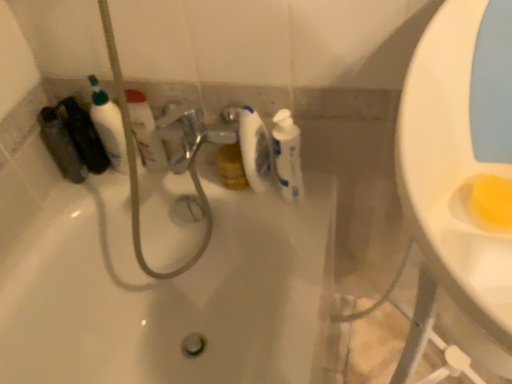
Question: Is white glossy bottle at center, the second cleaning product from the left, far from white glossy bottle at upper left, arranged as the 1th cleaning product when viewed from the left?

Choices:
 (A) yes
 (B) no

Answer: (B)

Question: From the image's perspective, is white glossy bottle at center, marked as the first cleaning product in a right-to-left arrangement, beneath white glossy bottle at upper left, which ranks as the second cleaning product in right-to-left order?

Choices:
 (A) no
 (B) yes

Answer: (B)

Question: Considering the relative sizes of white glossy bottle at center, marked as the first cleaning product in a right-to-left arrangement, and white glossy bottle at upper left, which ranks as the second cleaning product in right-to-left order, in the image provided, is white glossy bottle at center, marked as the first cleaning product in a right-to-left arrangement, thinner than white glossy bottle at upper left, which ranks as the second cleaning product in right-to-left order,?

Choices:
 (A) yes
 (B) no

Answer: (B)

Question: Considering the relative positions of white glossy bottle at center, marked as the first cleaning product in a right-to-left arrangement, and white glossy bottle at upper left, which ranks as the second cleaning product in right-to-left order, in the image provided, is white glossy bottle at center, marked as the first cleaning product in a right-to-left arrangement, to the left of white glossy bottle at upper left, which ranks as the second cleaning product in right-to-left order, from the viewer's perspective?

Choices:
 (A) yes
 (B) no

Answer: (B)

Question: From a real-world perspective, is white glossy bottle at center, the second cleaning product from the left, positioned over white glossy bottle at upper left, arranged as the 1th cleaning product when viewed from the left, based on gravity?

Choices:
 (A) no
 (B) yes

Answer: (B)

Question: Relative to white glossy bathtub at center, is white glossy bottle at center, marked as the first cleaning product in a right-to-left arrangement, in front or behind?

Choices:
 (A) behind
 (B) front

Answer: (A)

Question: Is white glossy bottle at center, the second cleaning product from the left, taller or shorter than white glossy bathtub at center?

Choices:
 (A) short
 (B) tall

Answer: (A)

Question: Do you think white glossy bottle at center, marked as the first cleaning product in a right-to-left arrangement, is within white glossy bathtub at center, or outside of it?

Choices:
 (A) outside
 (B) inside

Answer: (A)

Question: From the image's perspective, is white glossy bottle at center, marked as the first cleaning product in a right-to-left arrangement, above or below white glossy bathtub at center?

Choices:
 (A) above
 (B) below

Answer: (A)

Question: Is white glossy toilet paper at center wider or thinner than white glossy bottle at center, the second cleaning product from the left?

Choices:
 (A) wide
 (B) thin

Answer: (B)

Question: Considering the positions of white glossy toilet paper at center and white glossy bottle at center, the second cleaning product from the left, in the image, is white glossy toilet paper at center taller or shorter than white glossy bottle at center, the second cleaning product from the left,?

Choices:
 (A) tall
 (B) short

Answer: (A)

Question: Considering the positions of point 254,129 and point 298,132, is point 254,129 closer or farther from the camera than point 298,132?

Choices:
 (A) closer
 (B) farther

Answer: (B)

Question: From a real-world perspective, relative to white glossy bottle at center, marked as the first cleaning product in a right-to-left arrangement, is white glossy toilet paper at center vertically above or below?

Choices:
 (A) below
 (B) above

Answer: (B)

Question: From a real-world perspective, is white glossy bottle at center, the second cleaning product from the left, physically located above or below white glossy bottle at upper left, which ranks as the second cleaning product in right-to-left order?

Choices:
 (A) below
 (B) above

Answer: (B)

Question: From the image's perspective, is white glossy bottle at center, marked as the first cleaning product in a right-to-left arrangement, located above or below white glossy bottle at upper left, arranged as the 1th cleaning product when viewed from the left?

Choices:
 (A) below
 (B) above

Answer: (A)